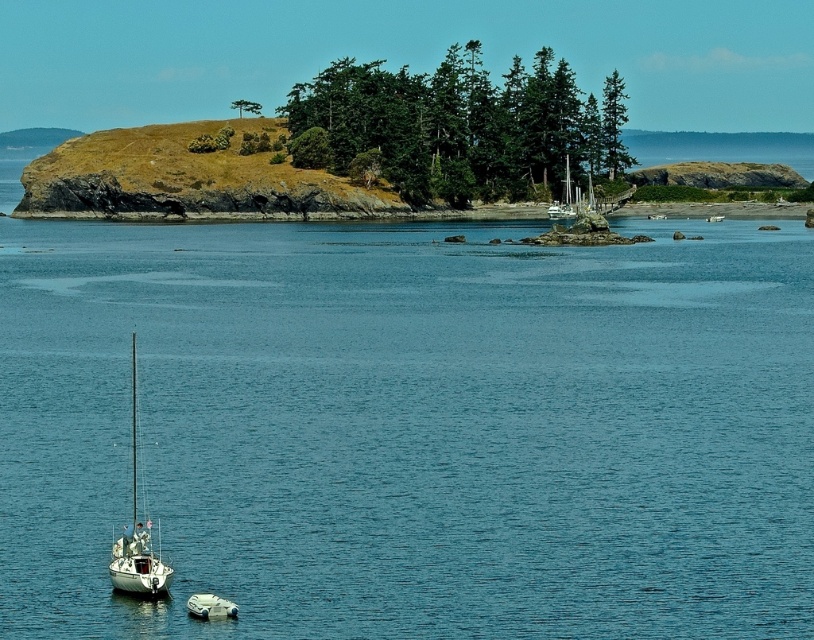
You are a sailor navigating a small boat and need to avoid obstacles. You see the brown grassy island at center and the white rubber dinghy at lower center. Which object is closer to your current position?

The white rubber dinghy at lower center is closer to your current position because it is positioned below the brown grassy island at center, which is further away.

You are standing on the shore and see the clear blue water at center and the white rubber dinghy at lower center. Which object is higher in the image?

The clear blue water at center is much taller than the white rubber dinghy at lower center in the image.

You are a photographer trying to capture the white rubber dinghy at lower center and the clear blue water at center in the same frame. Which object will appear wider in your photo?

The clear blue water at center will appear wider in the photo because its width surpasses that of the white rubber dinghy at lower center.